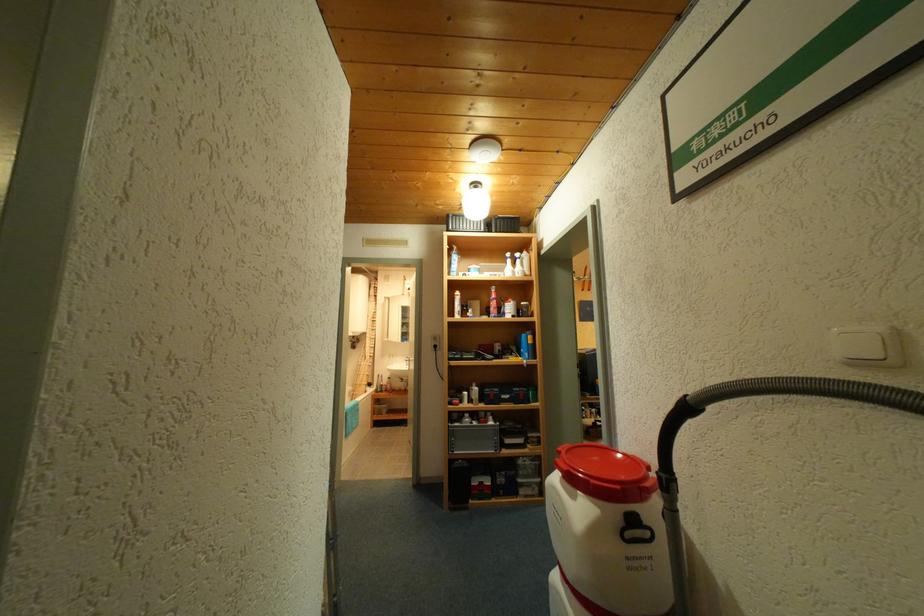
Find where to press the white light switch. Please return your answer as a coordinate pair (x, y).

(860, 345)